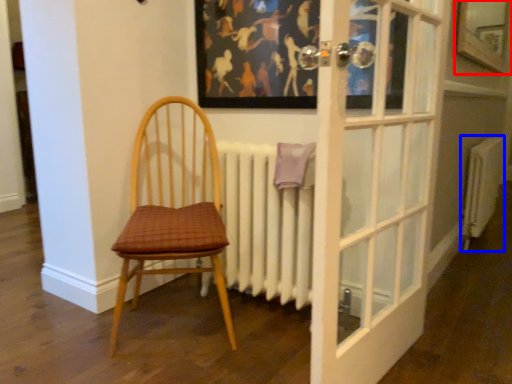
Question: Which object is closer to the camera taking this photo, window (highlighted by a red box) or radiator (highlighted by a blue box)?

Choices:
 (A) window
 (B) radiator

Answer: (A)